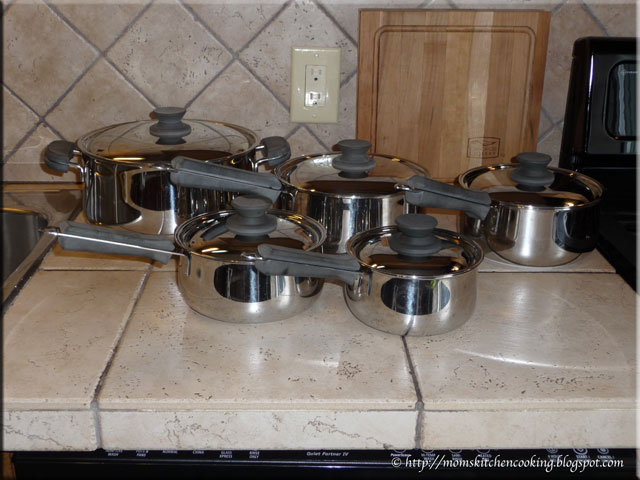
Identify the location of pot handles. coord(312,261), coord(129,235), coord(220,178), coord(404,188).